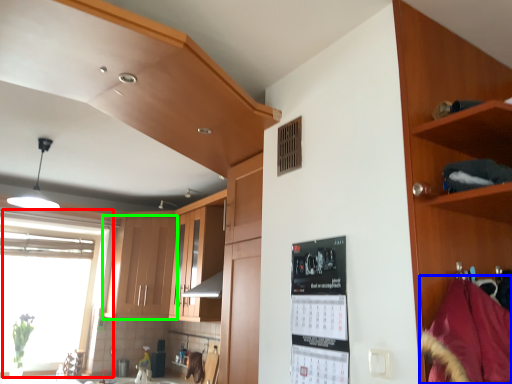
Question: Which object is the closest to the window (highlighted by a red box)? Choose among these: material (highlighted by a blue box) or cabinetry (highlighted by a green box).

Choices:
 (A) material
 (B) cabinetry

Answer: (B)